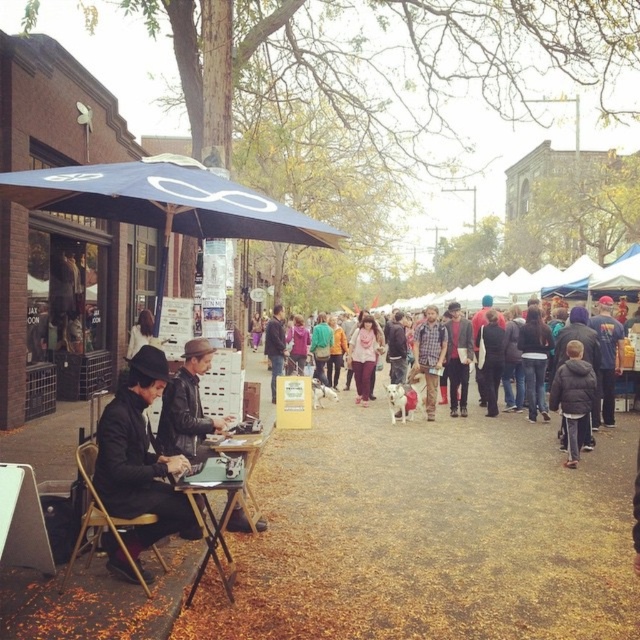
Question: Estimate the real-world distances between objects in this image. Which object is farther from the navy blue fabric umbrella at upper left?

Choices:
 (A) wooden table at center
 (B) wooden table at lower left
 (C) black matte laptop at left

Answer: (A)

Question: Is navy blue fabric umbrella at upper left bigger than black matte laptop at left?

Choices:
 (A) yes
 (B) no

Answer: (A)

Question: Is wooden table at lower left positioned in front of wooden table at center?

Choices:
 (A) no
 (B) yes

Answer: (B)

Question: Considering the real-world distances, which object is closest to the black matte laptop at left?

Choices:
 (A) wooden table at center
 (B) navy blue fabric umbrella at upper left
 (C) wooden table at lower left

Answer: (C)

Question: Does black matte laptop at left appear on the right side of wooden table at center?

Choices:
 (A) yes
 (B) no

Answer: (B)

Question: Estimate the real-world distances between objects in this image. Which object is closer to the navy blue fabric umbrella at upper left?

Choices:
 (A) wooden table at lower left
 (B) black matte laptop at left

Answer: (B)